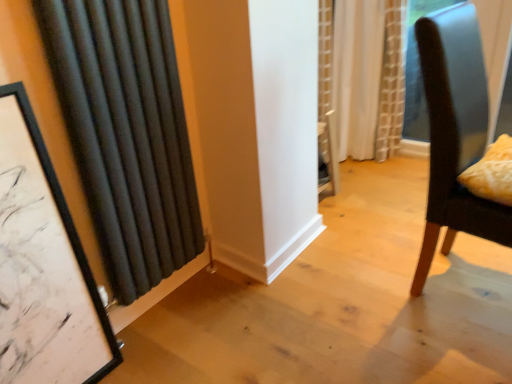
Question: Relative to matte black picture frame at left, is yellow textured pillow at right in front or behind?

Choices:
 (A) behind
 (B) front

Answer: (A)

Question: Is point (510, 183) positioned closer to the camera than point (23, 112)?

Choices:
 (A) closer
 (B) farther

Answer: (B)

Question: Considering the real-world distances, which object is farthest from the dark brown leather chair at right?

Choices:
 (A) black fabric curtain at left, acting as the 1th curtain starting from the front
 (B) white textured curtain at center, which is the 1th curtain from right to left
 (C) yellow textured pillow at right
 (D) matte black picture frame at left

Answer: (D)

Question: Which object is positioned closest to the black fabric curtain at left, acting as the 1th curtain starting from the front?

Choices:
 (A) matte black picture frame at left
 (B) yellow textured pillow at right
 (C) white textured curtain at center, acting as the second curtain starting from the front
 (D) dark brown leather chair at right

Answer: (A)